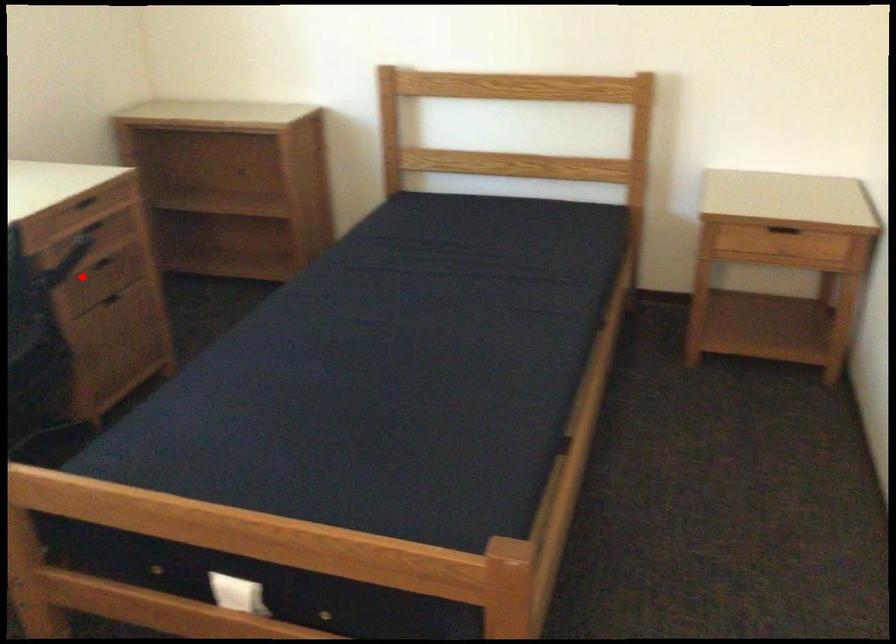
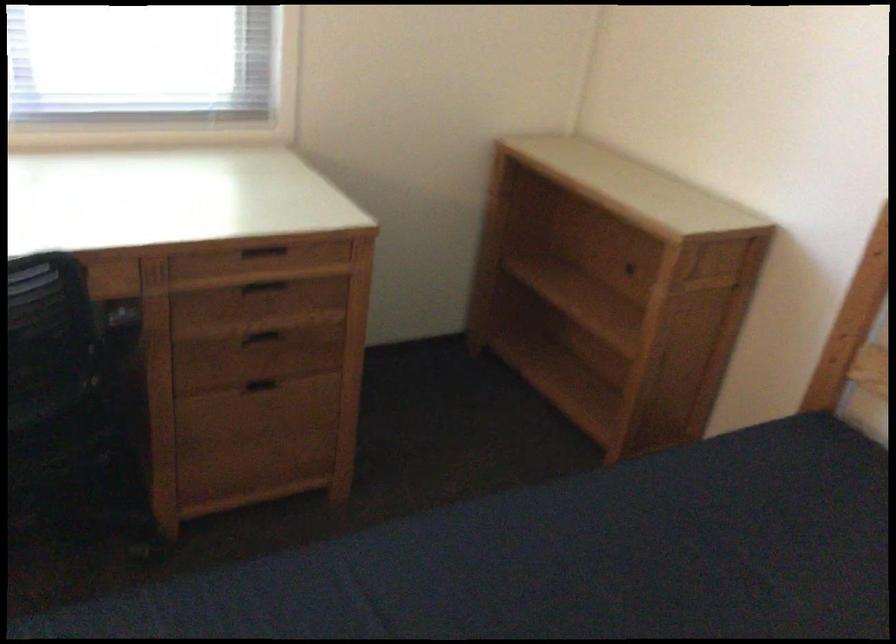
Locate, in the second image, the point that corresponds to the highlighted location in the first image.

(264, 333)